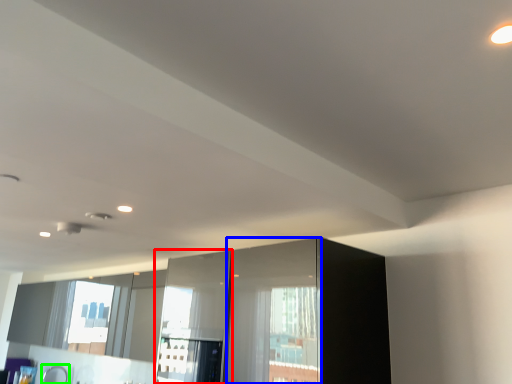
Question: Estimate the real-world distances between objects in this image. Which object is closer to screen door (highlighted by a red box), screen door (highlighted by a blue box) or faucet (highlighted by a green box)?

Choices:
 (A) screen door
 (B) faucet

Answer: (A)